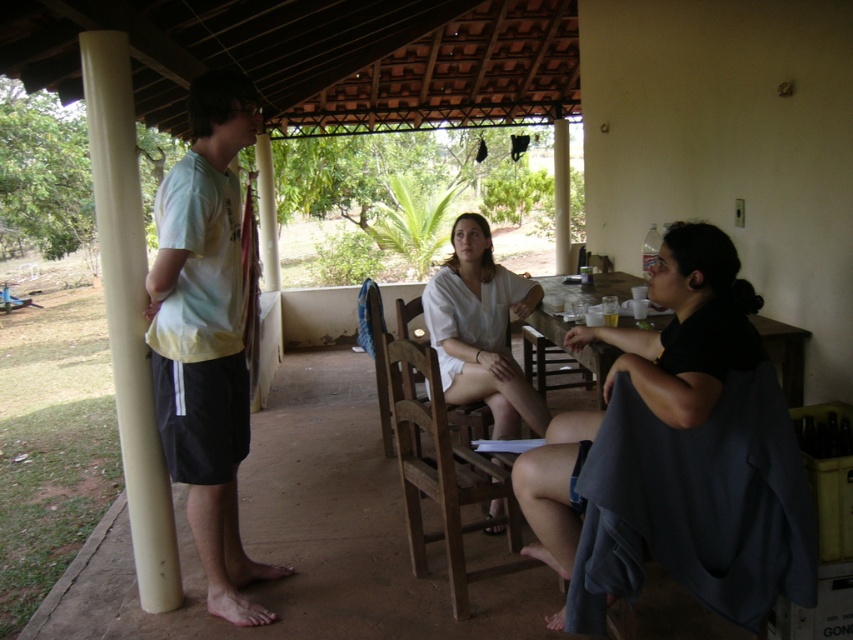
You are standing at the wooden table in the foreground and want to reach both the point at coordinates (x=442, y=472) and the point at coordinates (x=602, y=288). Which point will require you to walk a shorter distance?

Point at coordinates (x=442, y=472) is closer to the viewer than point at coordinates (x=602, y=288), so you will need to walk a shorter distance to reach the point at coordinates (x=442, y=472).